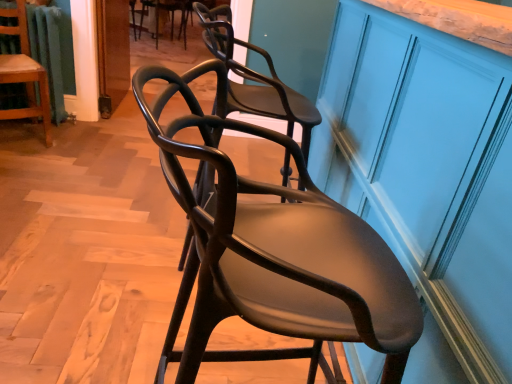
Question: Does matte blue cabinet at right have a smaller size compared to wooden chair at left, which appears as the 2th chair when viewed from the back?

Choices:
 (A) yes
 (B) no

Answer: (B)

Question: Is matte blue cabinet at right in front of wooden chair at left, which appears as the second chair when viewed from the top?

Choices:
 (A) no
 (B) yes

Answer: (B)

Question: From a real-world perspective, is matte blue cabinet at right physically below wooden chair at left, which appears as the second chair when viewed from the top?

Choices:
 (A) yes
 (B) no

Answer: (B)

Question: From the image's perspective, does matte blue cabinet at right appear lower than wooden chair at left, which ranks as the 2th chair in front-to-back order?

Choices:
 (A) no
 (B) yes

Answer: (B)

Question: Is wooden chair at left, acting as the 1th chair starting from the left, a part of matte blue cabinet at right?

Choices:
 (A) yes
 (B) no

Answer: (B)

Question: From the image's perspective, relative to wooden chair at left, which is counted as the second chair, starting from the bottom, is matte dark wood chair at center, placed as the third chair when sorted from top to bottom, above or below?

Choices:
 (A) below
 (B) above

Answer: (A)

Question: From their relative heights in the image, would you say matte dark wood chair at center, acting as the 3th chair starting from the left, is taller or shorter than wooden chair at left, which appears as the 2th chair when viewed from the back?

Choices:
 (A) short
 (B) tall

Answer: (B)

Question: Is matte dark wood chair at center, acting as the 3th chair starting from the left, bigger or smaller than wooden chair at left, placed as the third chair when sorted from right to left?

Choices:
 (A) small
 (B) big

Answer: (B)

Question: Looking at their shapes, would you say matte dark wood chair at center, the first chair viewed from the front, is wider or thinner than wooden chair at left, which ranks as the 2th chair in front-to-back order?

Choices:
 (A) wide
 (B) thin

Answer: (A)

Question: Considering the positions of matte blue cabinet at right and matte black chair at upper center, the 1th chair when ordered from top to bottom, in the image, is matte blue cabinet at right bigger or smaller than matte black chair at upper center, the 1th chair when ordered from top to bottom,?

Choices:
 (A) big
 (B) small

Answer: (A)

Question: Considering the positions of matte blue cabinet at right and matte black chair at upper center, the 1th chair when ordered from back to front, in the image, is matte blue cabinet at right wider or thinner than matte black chair at upper center, the 1th chair when ordered from back to front,?

Choices:
 (A) thin
 (B) wide

Answer: (A)

Question: Is matte blue cabinet at right to the left or to the right of matte black chair at upper center, the 1th chair when ordered from top to bottom, in the image?

Choices:
 (A) right
 (B) left

Answer: (A)

Question: Is point (440, 114) positioned closer to the camera than point (158, 36)?

Choices:
 (A) closer
 (B) farther

Answer: (A)

Question: Is wooden chair at left, which appears as the 2th chair when viewed from the back, bigger or smaller than matte dark wood chair at center, placed as the first chair when sorted from right to left?

Choices:
 (A) small
 (B) big

Answer: (A)

Question: Is wooden chair at left, placed as the third chair when sorted from right to left, wider or thinner than matte dark wood chair at center, placed as the first chair when sorted from right to left?

Choices:
 (A) wide
 (B) thin

Answer: (B)